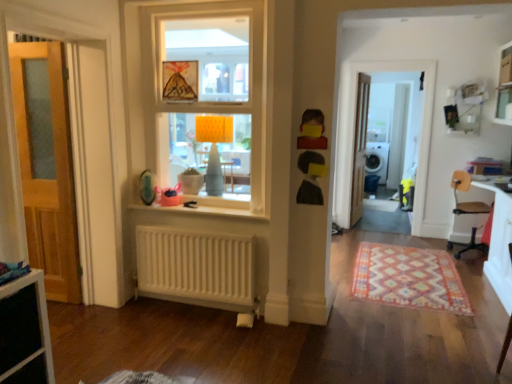
This screenshot has width=512, height=384. Identify the location of free point below white matte radiator at lower center (from a real-world perspective). (197, 306).